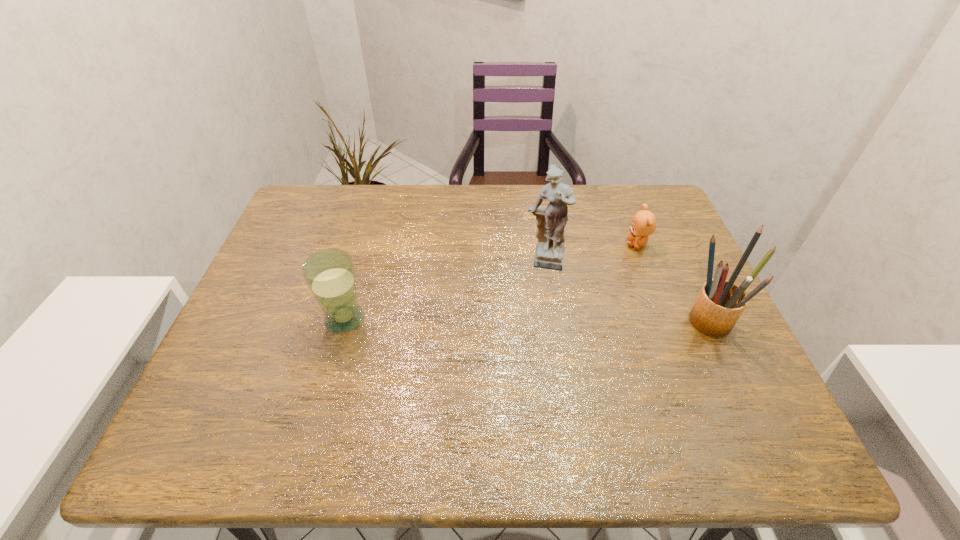
Where is `free spot between the third object from right to left and the glass`? The image size is (960, 540). free spot between the third object from right to left and the glass is located at coordinates (444, 291).

Find the location of a particular element. object that can be found as the third closest to the pencil box is located at coordinates (330, 275).

You are a GUI agent. You are given a task and a screenshot of the screen. Output one action in this format:
    pyautogui.click(x=<x>, y=<y>)
    Task: Click on the second closest object to the teddy bear
    The height and width of the screenshot is (540, 960).
    Given the screenshot: What is the action you would take?
    pyautogui.click(x=551, y=221)

Find the location of a particular element. vacant point that satisfies the following two spatial constraints: 1. on the back side of the teddy bear; 2. on the right side of the second shortest object is located at coordinates (366, 245).

Where is `free spot that satisfies the following two spatial constraints: 1. on the front side of the pencil box; 2. on the right side of the tallest object`? Image resolution: width=960 pixels, height=540 pixels. free spot that satisfies the following two spatial constraints: 1. on the front side of the pencil box; 2. on the right side of the tallest object is located at coordinates (554, 320).